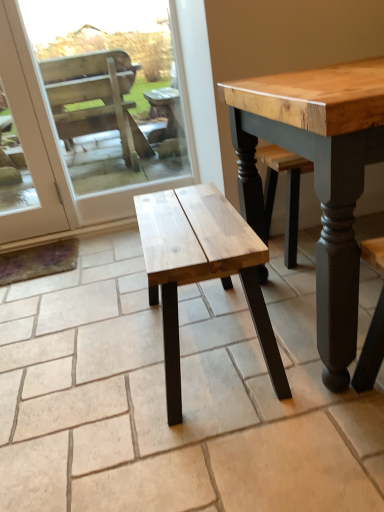
Question: Is wooden bench at lower center positioned before natural wood bench at center?

Choices:
 (A) no
 (B) yes

Answer: (A)

Question: Does wooden bench at lower center have a lesser height compared to natural wood bench at center?

Choices:
 (A) no
 (B) yes

Answer: (A)

Question: From the image's perspective, is wooden bench at lower center located beneath natural wood bench at center?

Choices:
 (A) yes
 (B) no

Answer: (B)

Question: From the image's perspective, is wooden bench at lower center over natural wood bench at center?

Choices:
 (A) no
 (B) yes

Answer: (B)

Question: Is wooden bench at lower center turned away from natural wood bench at center?

Choices:
 (A) no
 (B) yes

Answer: (A)

Question: Is wooden bench at lower center oriented towards natural wood bench at center?

Choices:
 (A) yes
 (B) no

Answer: (A)

Question: Is natural wood bench at center turned away from wooden bench at lower center?

Choices:
 (A) no
 (B) yes

Answer: (A)

Question: From a real-world perspective, is natural wood bench at center below wooden bench at lower center?

Choices:
 (A) no
 (B) yes

Answer: (B)

Question: Can you confirm if natural wood bench at center is smaller than wooden bench at lower center?

Choices:
 (A) no
 (B) yes

Answer: (A)

Question: Does natural wood bench at center have a greater width compared to wooden bench at lower center?

Choices:
 (A) no
 (B) yes

Answer: (B)

Question: Considering the relative sizes of natural wood bench at center and wooden bench at lower center in the image provided, is natural wood bench at center thinner than wooden bench at lower center?

Choices:
 (A) yes
 (B) no

Answer: (B)

Question: Is natural wood bench at center beside wooden bench at lower center?

Choices:
 (A) no
 (B) yes

Answer: (A)

Question: Is natural wood bench at center in front of or behind wooden bench at lower center in the image?

Choices:
 (A) front
 (B) behind

Answer: (A)